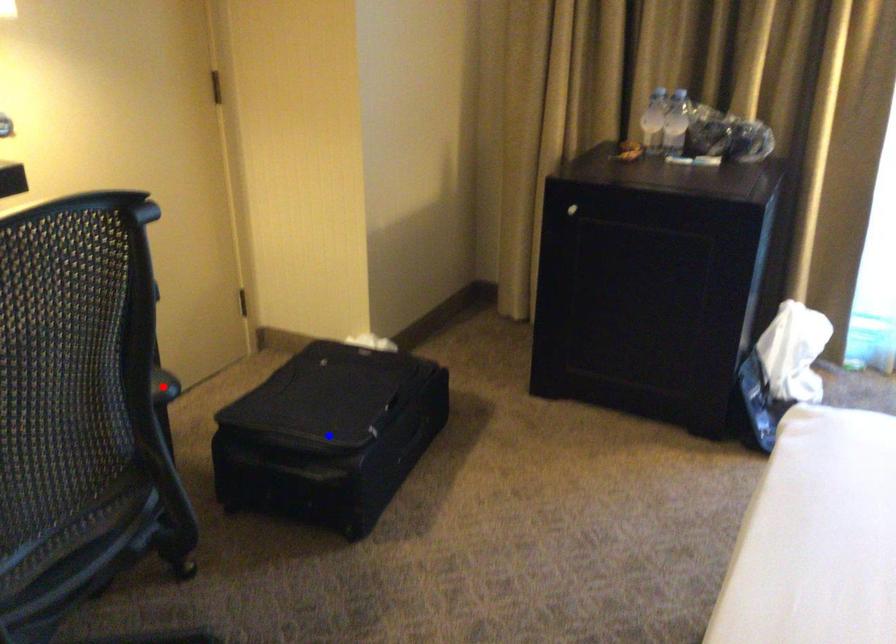
Question: Two points are marked on the image. Which point is closer to the camera?

Choices:
 (A) Blue point is closer.
 (B) Red point is closer.

Answer: (A)